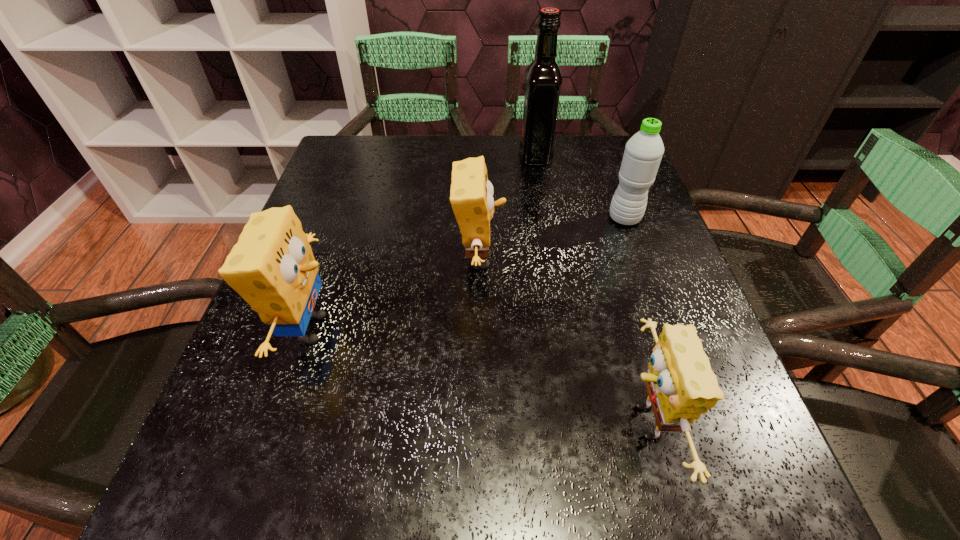
The image size is (960, 540). Find the location of `free region located 0.340m on the back of the water bottle`. free region located 0.340m on the back of the water bottle is located at coordinates (594, 135).

You are a GUI agent. You are given a task and a screenshot of the screen. Output one action in this format:
    pyautogui.click(x=<x>, y=<y>)
    Task: Click on the free space located on the face of the leftmost object
    
    Given the screenshot: What is the action you would take?
    pyautogui.click(x=393, y=329)

At what (x,y) coordinates should I click in order to perform the action: click on vacant region located 0.230m on the face of the second sponge from right to left. Please return your answer as a coordinate pair (x, y). This screenshot has height=540, width=960. Looking at the image, I should click on (616, 259).

At what (x,y) coordinates should I click in order to perform the action: click on vacant region located on the face of the fourth object from left to right. Please return your answer as a coordinate pair (x, y). Looking at the image, I should click on (348, 423).

Find the location of a particular element. Image resolution: width=960 pixels, height=540 pixels. free location located on the face of the fourth object from left to right is located at coordinates (402, 423).

Where is `vacant region located on the face of the fourth object from left to right`? This screenshot has width=960, height=540. vacant region located on the face of the fourth object from left to right is located at coordinates (504, 423).

Identify the location of object at the far edge. (543, 76).

Where is `object present at the near edge`? object present at the near edge is located at coordinates (681, 386).

You are a GUI agent. You are given a task and a screenshot of the screen. Output one action in this format:
    pyautogui.click(x=<x>, y=<y>)
    Task: Click on the object present at the left edge
    
    Given the screenshot: What is the action you would take?
    pyautogui.click(x=272, y=267)

The image size is (960, 540). I want to click on water bottle that is at the right edge, so click(x=643, y=152).